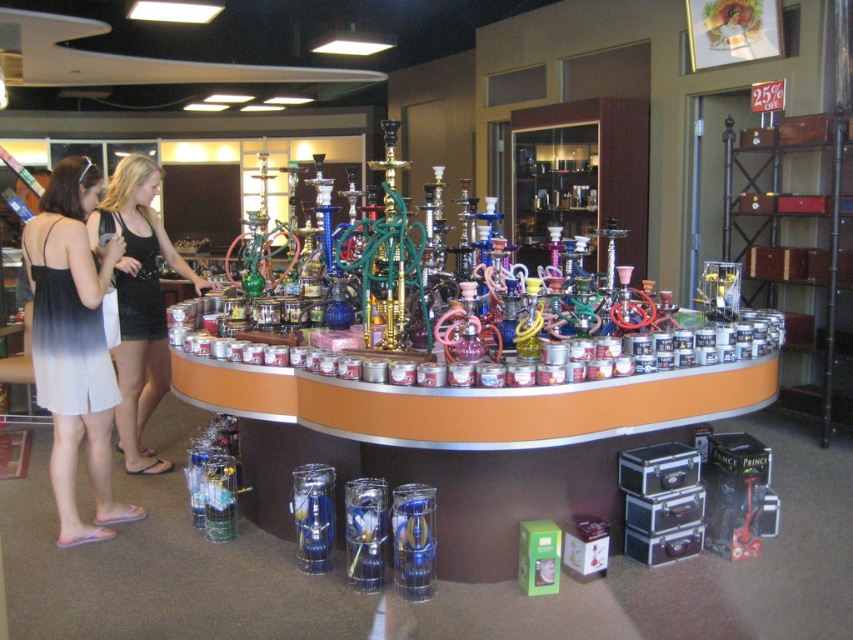
From the picture: You are a customer in the store and want to buy a dress. You see the white fabric dress at left and the black dress at left. Which dress is closer to the center of the store?

The white fabric dress at left is closer to the center of the store because it is positioned to the right of the black dress at left.

In the scene shown: You are standing in the retail store and want to reach the point marked as point (184, 276). There is an obstacle at point (97, 298). Can you walk directly to your destination without going around?

Point (97, 298) is in front of point (184, 276), so you cannot walk directly to point (184, 276) without going around the obstacle at point (97, 298).